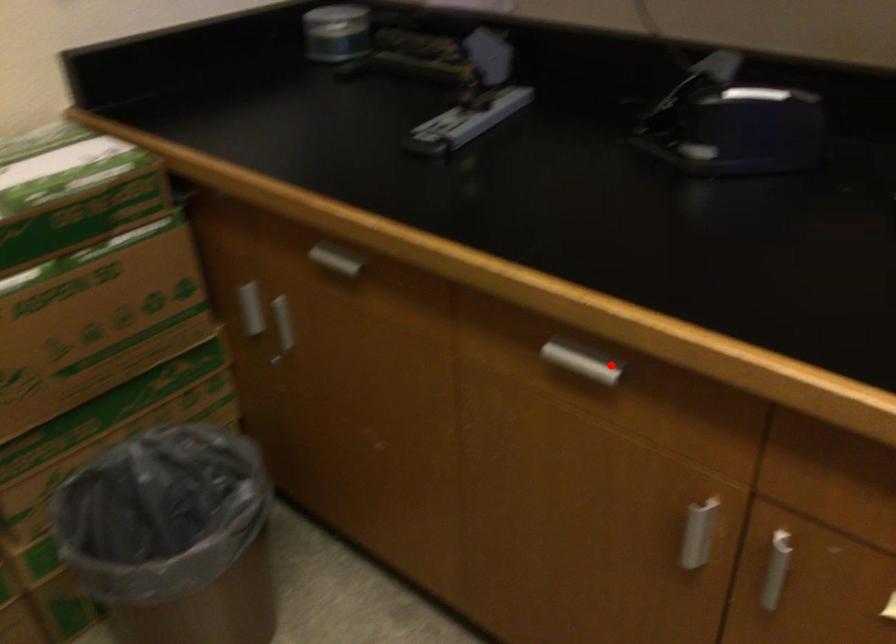
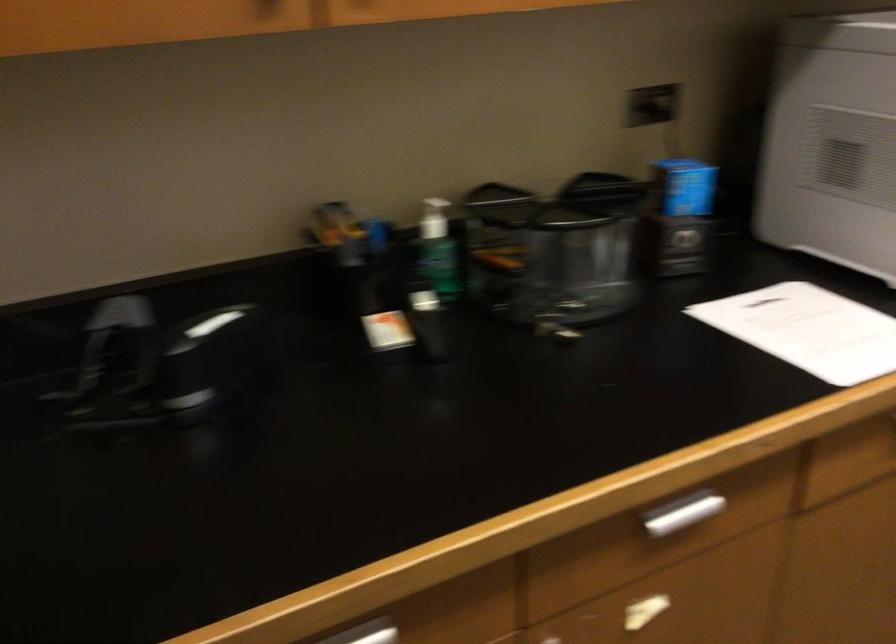
Question: I am providing you with two images of the same scene from different viewpoints. Given a red point in image1, look at the same physical point in image2. Is it:

Choices:
 (A) Closer to the viewpoint
 (B) Farther from the viewpoint

Answer: (A)